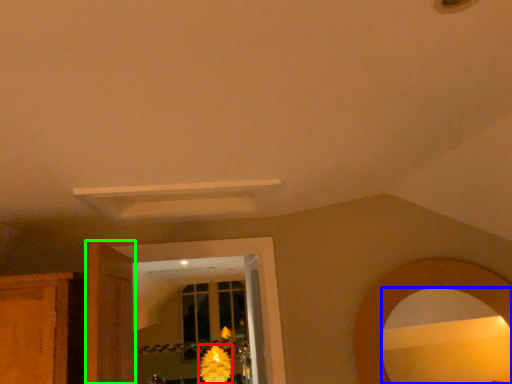
Question: Which object is the farthest from flower (highlighted by a red box)? Choose among these: mirror (highlighted by a blue box) or door (highlighted by a green box).

Choices:
 (A) mirror
 (B) door

Answer: (A)